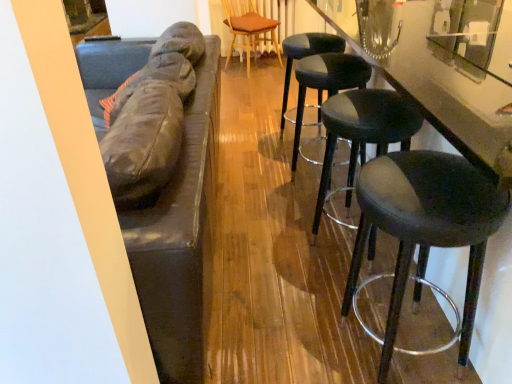
Question: From their relative heights in the image, would you say matte black stool at right, the second stool in the front-to-back sequence, is taller or shorter than glossy black counter at right?

Choices:
 (A) short
 (B) tall

Answer: (A)

Question: Looking at their shapes, would you say matte black stool at right, the second stool in the front-to-back sequence, is wider or thinner than glossy black counter at right?

Choices:
 (A) wide
 (B) thin

Answer: (B)

Question: Estimate the real-world distances between objects in this image. Which object is farther from the black leather stool at center, arranged as the 1th stool when viewed from the back?

Choices:
 (A) matte black stool at right, which is the third stool from back to front
 (B) glossy black counter at right
 (C) black leather stool at right, which is the third stool from front to back
 (D) wooden textured chair at center
 (E) black leather stool at right, which is the fourth stool from back to front

Answer: (D)

Question: Which of these objects is positioned farthest from the black leather stool at right, marked as the first stool in a front-to-back arrangement?

Choices:
 (A) glossy black counter at right
 (B) wooden textured chair at center
 (C) black leather stool at center, arranged as the 1th stool when viewed from the back
 (D) matte black stool at right, which is the third stool from back to front
 (E) black leather stool at right, the 2th stool in the back-to-front sequence

Answer: (B)